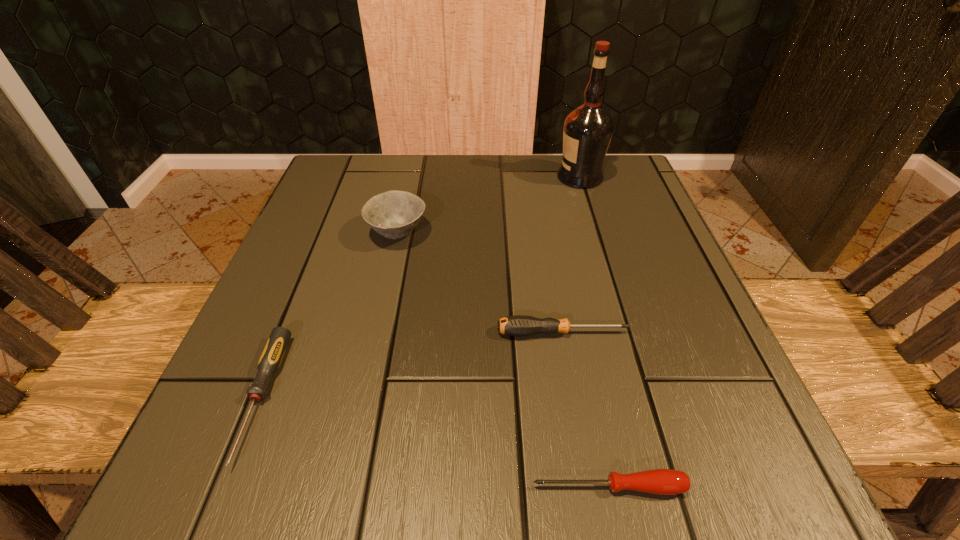
Identify the location of vacant space located 0.300m on the left of the nearest object. (283, 487).

Image resolution: width=960 pixels, height=540 pixels. I want to click on object at the far edge, so click(x=588, y=129).

I want to click on bowl that is at the left edge, so [x=394, y=214].

The image size is (960, 540). Identify the location of screwdriver located in the left edge section of the desktop. (270, 360).

Image resolution: width=960 pixels, height=540 pixels. Find the location of `liquor present at the right edge`. liquor present at the right edge is located at coordinates (588, 129).

The width and height of the screenshot is (960, 540). I want to click on object that is at the near left corner, so click(270, 360).

Where is `object positioned at the far right corner`? object positioned at the far right corner is located at coordinates (588, 129).

Identify the location of object that is at the near right corner. point(657,481).

The width and height of the screenshot is (960, 540). Identify the location of free spot at the far edge of the desktop. (406, 167).

This screenshot has width=960, height=540. I want to click on vacant space at the left edge, so click(x=294, y=259).